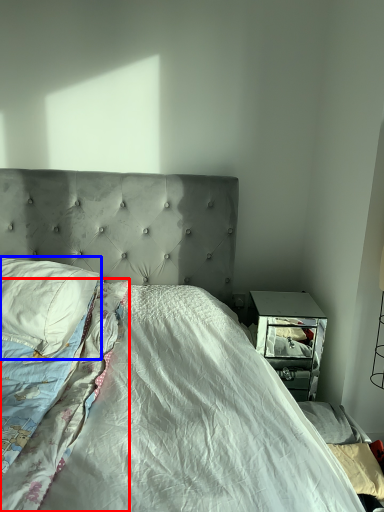
Question: Which point is further to the camera, blanket (highlighted by a red box) or pillow (highlighted by a blue box)?

Choices:
 (A) blanket
 (B) pillow

Answer: (B)